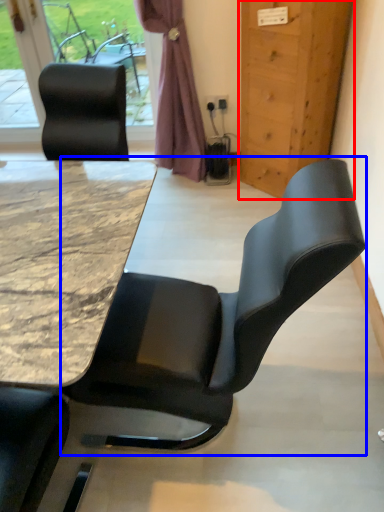
Question: Which object is further to the camera taking this photo, door (highlighted by a red box) or chair (highlighted by a blue box)?

Choices:
 (A) door
 (B) chair

Answer: (A)